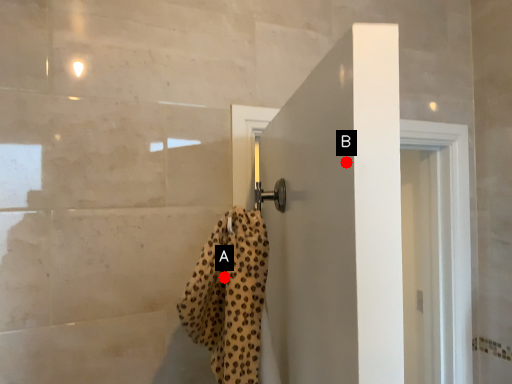
Question: Two points are circled on the image, labeled by A and B beside each circle. Which point is farther from the camera taking this photo?

Choices:
 (A) A is further
 (B) B is further

Answer: (A)